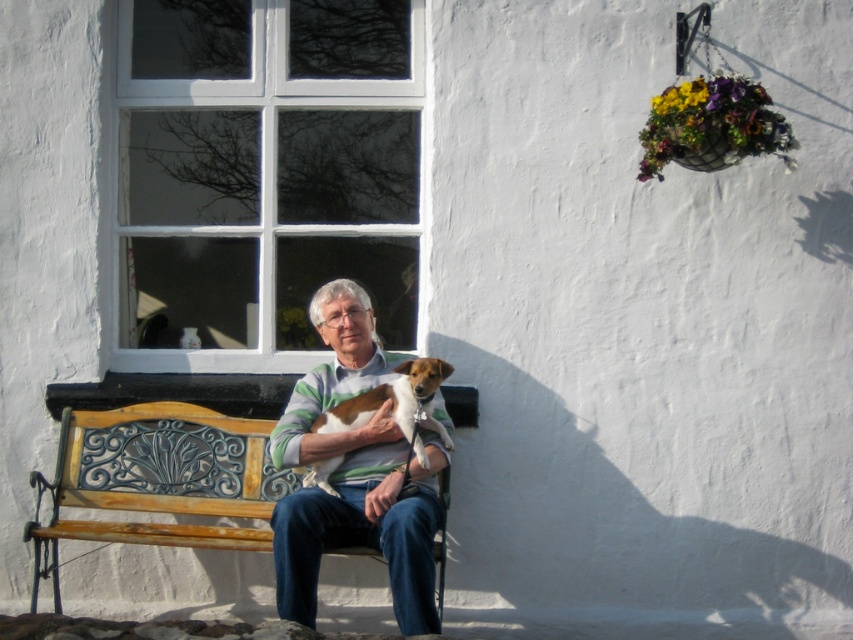
Between striped sweater at center and wooden bench at center, which one appears on the left side from the viewer's perspective?

Positioned to the left is wooden bench at center.

Where is `striped sweater at center`? striped sweater at center is located at coordinates (352, 474).

Which of these two, wooden bench at center or brown and white fur at center, stands taller?

wooden bench at center is taller.

Is point (91, 456) farther from viewer compared to point (349, 412)?

Yes, it is.

Is point (189, 500) closer to camera compared to point (329, 472)?

No, it is behind (329, 472).

Locate an element on the screen. wooden bench at center is located at coordinates (158, 477).

Can you confirm if striped sweater at center is positioned below brown and white fur at center?

Correct, striped sweater at center is located below brown and white fur at center.

Is point (276, 429) positioned before point (350, 406)?

No.

At what (x,y) coordinates should I click in order to perform the action: click on striped sweater at center. Please return your answer as a coordinate pair (x, y). Looking at the image, I should click on (352, 474).